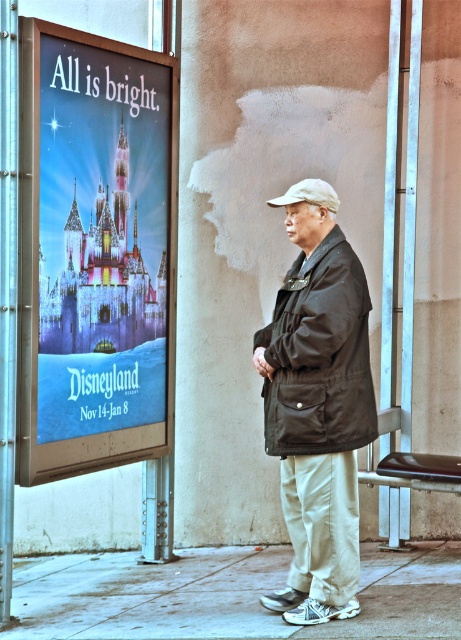
Please describe the location of the gray concrete pavement at lower center in terms of coordinates within the image frame. Use the coordinate system where the bottom left corner is the origin point.

The gray concrete pavement at lower center is located at coordinates approximately 0.931 on the x axis and 0.495 on the y axis within the image frame.

You are at the bus stop and want to know if the point at coordinates point [89,150] is in front of or behind point [291,381]. Can you determine this based on the scene?

Based on the scene description, point [89,150] is behind point [291,381].

You are a pedestrian approaching the bus stop. You see the gray concrete pavement at lower center and the black matte jacket at center. Which object is closer to you as you approach?

The gray concrete pavement at lower center is closer to you because it is in front of the black matte jacket at center.